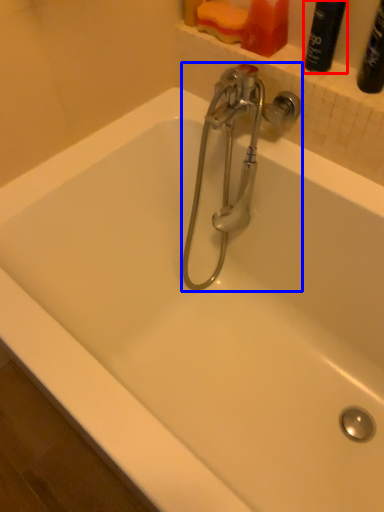
Question: Among these objects, which one is nearest to the camera, cleaning product (highlighted by a red box) or tap (highlighted by a blue box)?

Choices:
 (A) cleaning product
 (B) tap

Answer: (A)